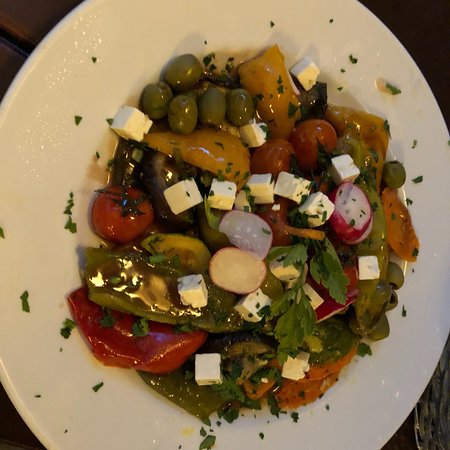
Find the location of a particular element. The height and width of the screenshot is (450, 450). bottom edge of bowl is located at coordinates (443, 348), (430, 378), (399, 426), (34, 433), (1, 380).